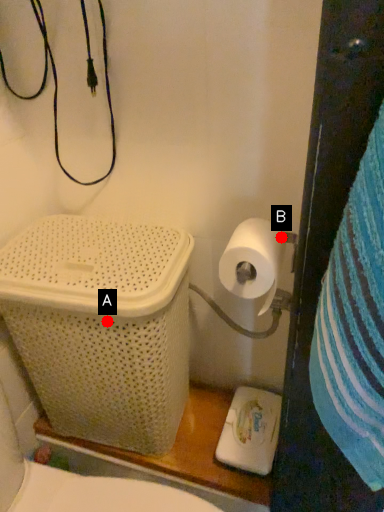
Question: Two points are circled on the image, labeled by A and B beside each circle. Which of the following is the farthest from the observer?

Choices:
 (A) A is further
 (B) B is further

Answer: (A)